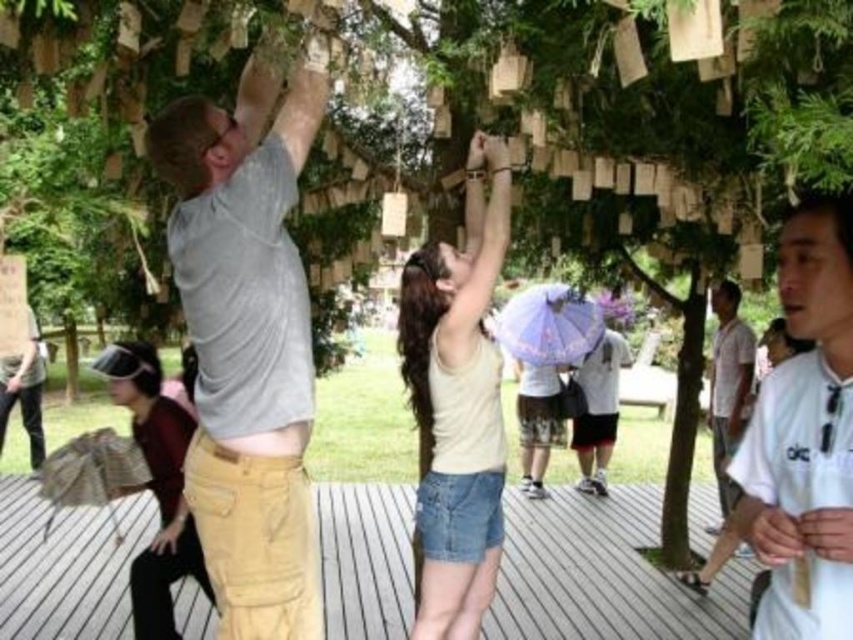
Looking at this image, who is more distant from viewer, [737,392] or [583,369]?

The point [583,369] is more distant.

Is white cotton shirt at right in front of matte purple umbrella at center?

Yes, it is.

Does point (711, 381) come closer to viewer compared to point (596, 444)?

Yes.

This screenshot has height=640, width=853. What are the coordinates of `white cotton shirt at right` in the screenshot? It's located at (728, 385).

How far apart are white matte shirt at center and white cotton shirt at right?

white matte shirt at center and white cotton shirt at right are 4.80 meters apart.

Which is more to the left, white matte shirt at center or white cotton shirt at right?

white matte shirt at center is more to the left.

Does point (750, 531) come farther from viewer compared to point (737, 417)?

No, (750, 531) is in front of (737, 417).

The height and width of the screenshot is (640, 853). In order to click on white matte shirt at center in this screenshot , I will do `click(805, 436)`.

Is khaki pants at upper center smaller than matte purple umbrella at center?

No.

Between point (270, 401) and point (619, 333), which one is positioned behind?

The point (619, 333) is behind.

The height and width of the screenshot is (640, 853). Identify the location of khaki pants at upper center. (248, 333).